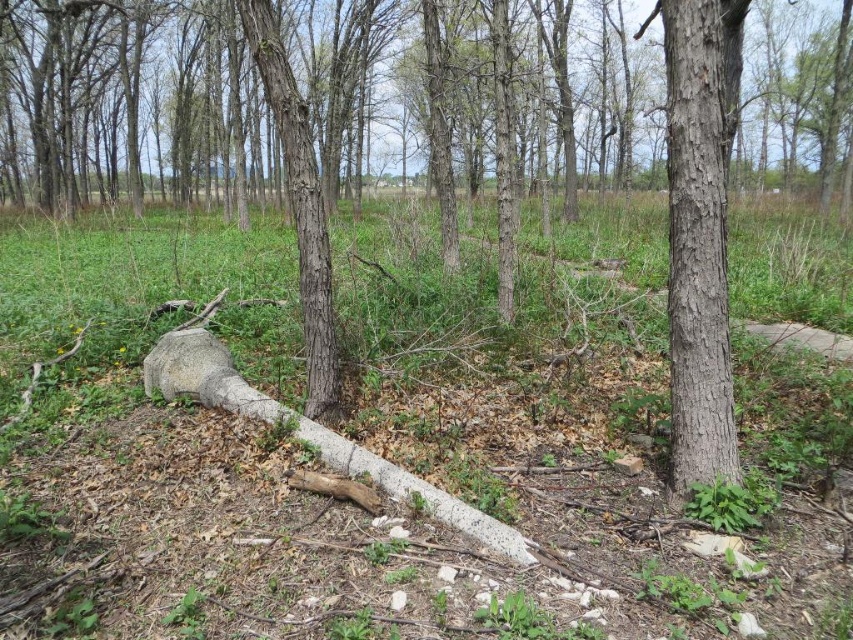
Question: Does smooth brown bark at right appear over smooth bark tree trunk at center?

Choices:
 (A) no
 (B) yes

Answer: (A)

Question: Which point is closer to the camera?

Choices:
 (A) smooth bark tree trunk at center
 (B) smooth brown bark at right

Answer: (B)

Question: Which point appears farthest from the camera in this image?

Choices:
 (A) (689, 449)
 (B) (315, 365)

Answer: (B)

Question: Does smooth brown bark at right have a larger size compared to smooth bark tree trunk at center?

Choices:
 (A) no
 (B) yes

Answer: (A)

Question: Where is smooth brown bark at right located in relation to smooth bark tree trunk at center in the image?

Choices:
 (A) right
 (B) left

Answer: (A)

Question: Among these objects, which one is farthest from the camera?

Choices:
 (A) smooth brown bark at right
 (B) smooth bark tree trunk at center

Answer: (B)